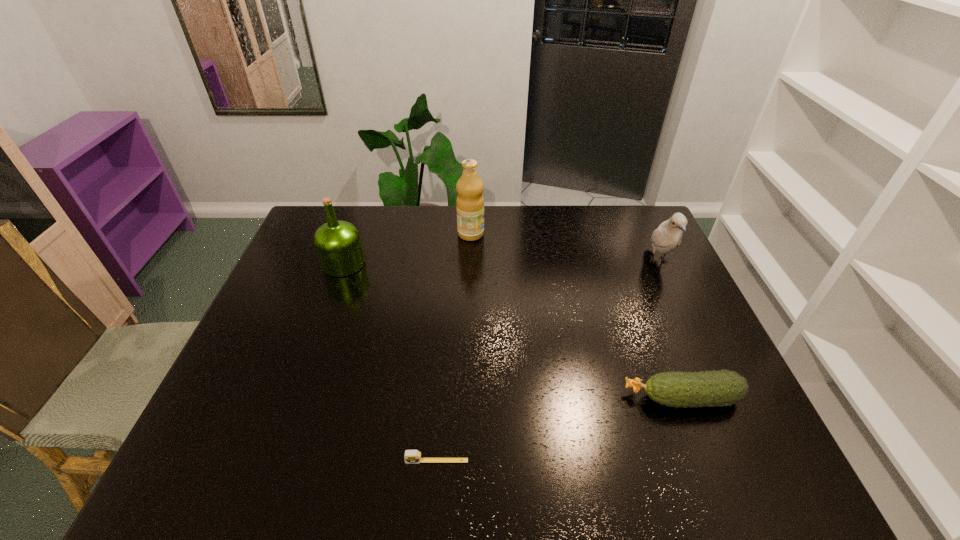
This screenshot has height=540, width=960. What are the coordinates of `the right olive oil` in the screenshot? It's located at (470, 202).

Where is `the farthest object`? This screenshot has width=960, height=540. the farthest object is located at coordinates (470, 202).

Locate an element on the screen. the nearer olive oil is located at coordinates (338, 245).

Locate an element on the screen. The image size is (960, 540). the left olive oil is located at coordinates (338, 245).

You are a GUI agent. You are given a task and a screenshot of the screen. Output one action in this format:
    pyautogui.click(x=<x>, y=<y>)
    Task: Click on the bird
    This screenshot has height=540, width=960.
    Given the screenshot: What is the action you would take?
    pyautogui.click(x=668, y=235)

Identify the location of cucumber. Image resolution: width=960 pixels, height=540 pixels. (719, 388).

The height and width of the screenshot is (540, 960). What are the coordinates of `the second shortest object` in the screenshot? It's located at (719, 388).

Where is `tape measure`? This screenshot has height=540, width=960. tape measure is located at coordinates (411, 456).

You are a GUI agent. You are given a task and a screenshot of the screen. Output one action in this format:
    pyautogui.click(x=<x>, y=<y>)
    Task: Click on the shortest object
    
    Given the screenshot: What is the action you would take?
    pyautogui.click(x=411, y=456)

This screenshot has height=540, width=960. I want to click on free space located 0.230m on the label of the farthest object, so click(x=549, y=234).